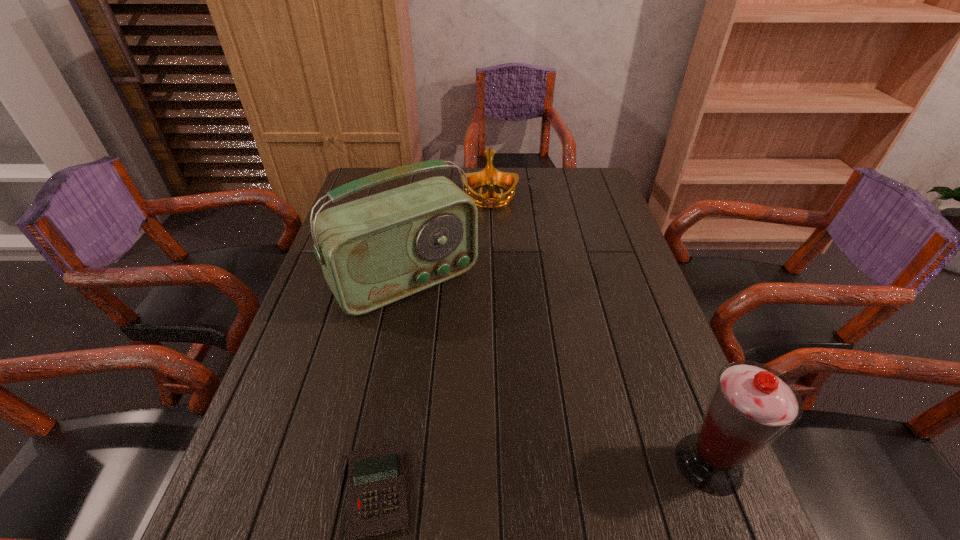
Find the location of a particular element. This screenshot has width=960, height=540. the rightmost object is located at coordinates (751, 405).

You are a GUI agent. You are given a task and a screenshot of the screen. Output one action in this format:
    pyautogui.click(x=<x>, y=<y>)
    Task: Click on the third nearest object
    
    Given the screenshot: What is the action you would take?
    pyautogui.click(x=374, y=251)

What are the coordinates of `tiara` in the screenshot? It's located at (490, 176).

I want to click on the farthest object, so click(490, 176).

The width and height of the screenshot is (960, 540). In order to click on free space located on the left of the smoothie in this screenshot , I will do (470, 463).

Locate an element on the screen. blank space located on the front panel of the second farthest object is located at coordinates (492, 384).

Image resolution: width=960 pixels, height=540 pixels. I want to click on vacant space located on the front panel of the second farthest object, so click(x=480, y=368).

Locate an element on the screen. This screenshot has width=960, height=540. blank space located 0.310m on the front panel of the second farthest object is located at coordinates (511, 407).

At what (x,y) coordinates should I click in order to perform the action: click on free space located 0.340m at the front emblem of the third tallest object. Please return your answer as a coordinate pair (x, y). This screenshot has width=960, height=540. Looking at the image, I should click on pos(494,285).

This screenshot has width=960, height=540. Find the location of `vacant space located 0.330m at the front emblem of the third tallest object`. vacant space located 0.330m at the front emblem of the third tallest object is located at coordinates (493, 282).